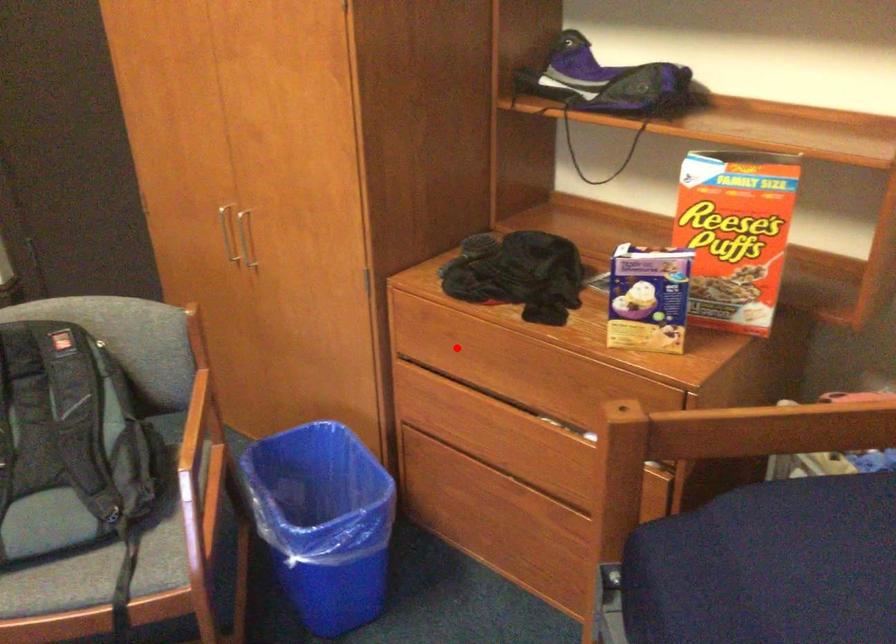
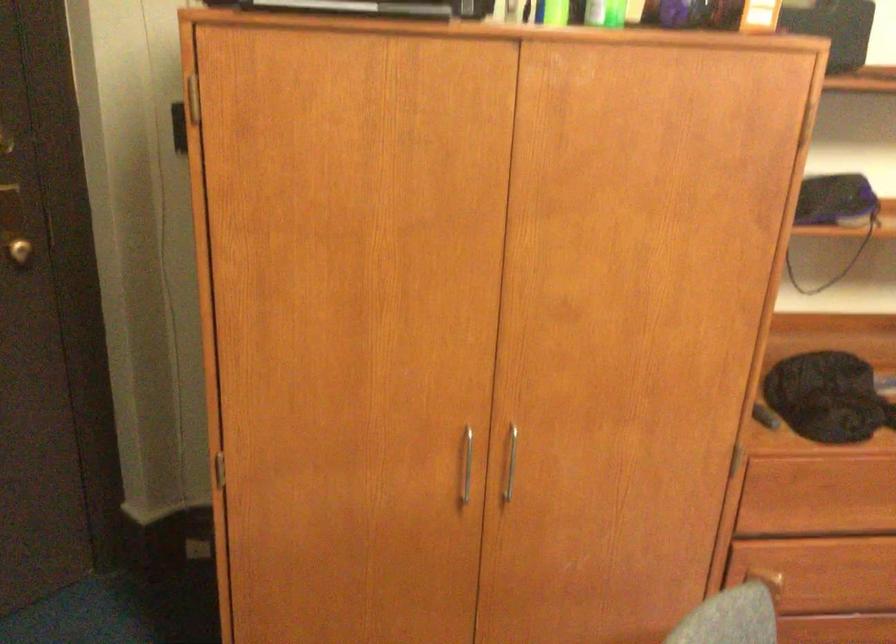
Where in the second image is the point corresponding to the highlighted location from the first image?

(825, 495)